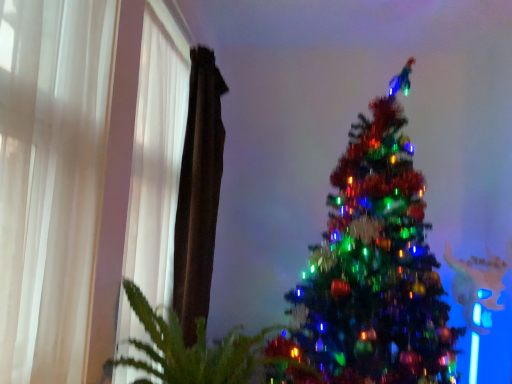
Question: Can you confirm if white sheer curtain at left, arranged as the second curtain when viewed from the back, is wider than brown fabric curtain at left, the first curtain viewed from the back?

Choices:
 (A) yes
 (B) no

Answer: (B)

Question: Is white sheer curtain at left, marked as the 2th curtain in a front-to-back arrangement, positioned behind brown fabric curtain at left, the first curtain viewed from the back?

Choices:
 (A) yes
 (B) no

Answer: (B)

Question: Would you say brown fabric curtain at left, the third curtain in the front-to-back sequence, is part of white sheer curtain at left, marked as the 2th curtain in a front-to-back arrangement,'s contents?

Choices:
 (A) no
 (B) yes

Answer: (A)

Question: Is white sheer curtain at left, arranged as the second curtain when viewed from the back, taller than brown fabric curtain at left, the third curtain in the front-to-back sequence?

Choices:
 (A) yes
 (B) no

Answer: (A)

Question: From the image's perspective, does white sheer curtain at left, marked as the 2th curtain in a front-to-back arrangement, appear lower than brown fabric curtain at left, the first curtain viewed from the back?

Choices:
 (A) no
 (B) yes

Answer: (B)

Question: From the image's perspective, does white sheer curtain at left, marked as the 2th curtain in a front-to-back arrangement, appear higher than brown fabric curtain at left, the third curtain in the front-to-back sequence?

Choices:
 (A) no
 (B) yes

Answer: (A)

Question: From a real-world perspective, is green leafy plant at lower left beneath white sheer curtain at left, arranged as the second curtain when viewed from the back?

Choices:
 (A) yes
 (B) no

Answer: (A)

Question: Considering the relative sizes of green leafy plant at lower left and white sheer curtain at left, marked as the 2th curtain in a front-to-back arrangement, in the image provided, is green leafy plant at lower left taller than white sheer curtain at left, marked as the 2th curtain in a front-to-back arrangement,?

Choices:
 (A) yes
 (B) no

Answer: (B)

Question: Would you say green leafy plant at lower left is outside white sheer curtain at left, marked as the 2th curtain in a front-to-back arrangement?

Choices:
 (A) yes
 (B) no

Answer: (A)

Question: From the image's perspective, is green leafy plant at lower left beneath white sheer curtain at left, arranged as the second curtain when viewed from the back?

Choices:
 (A) yes
 (B) no

Answer: (A)

Question: Are green leafy plant at lower left and white sheer curtain at left, arranged as the second curtain when viewed from the back, making contact?

Choices:
 (A) no
 (B) yes

Answer: (A)

Question: Is green leafy plant at lower left facing towards white sheer curtain at left, arranged as the second curtain when viewed from the back?

Choices:
 (A) no
 (B) yes

Answer: (A)

Question: From a real-world perspective, is white sheer curtain at left, arranged as the second curtain when viewed from the back, over shiny green christmas tree at center?

Choices:
 (A) no
 (B) yes

Answer: (B)